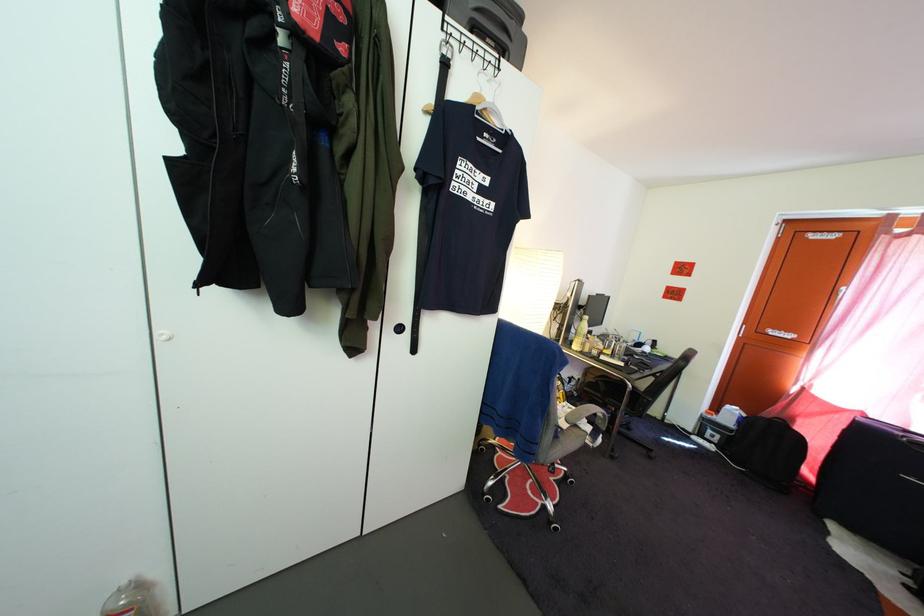
Where would you lift the plastic clothes hanger? Please return your answer as a coordinate pair (x, y).

(490, 95)